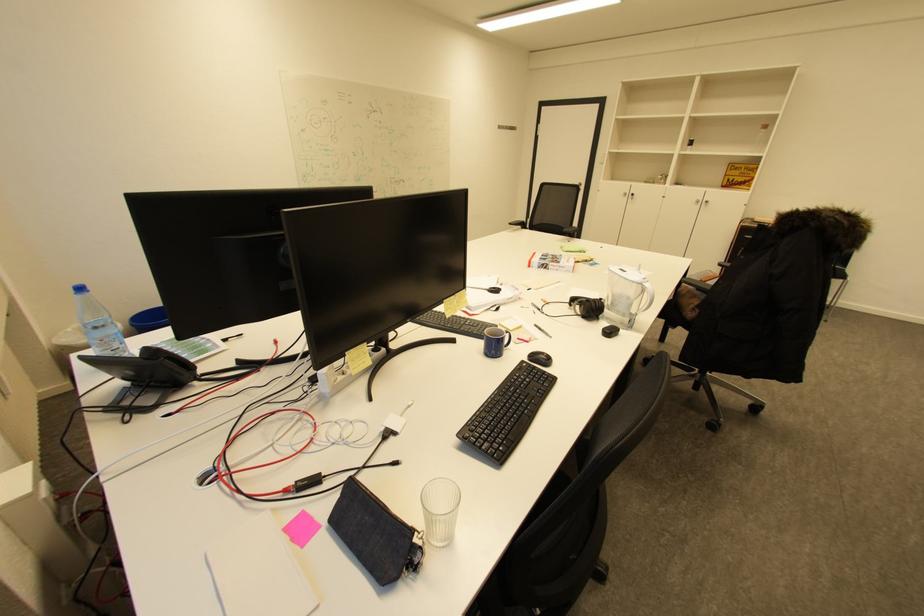
Find where to wear the black headphones. Please return your answer as a coordinate pair (x, y).

(587, 306)